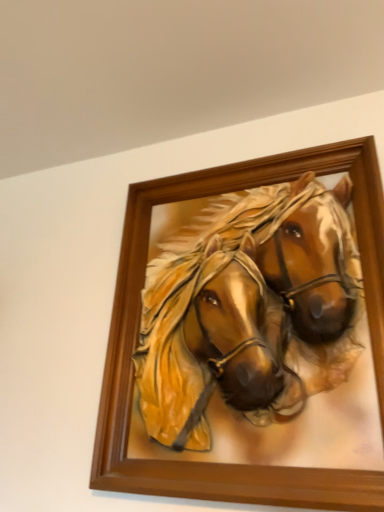
In order to face shiny gold horse at upper center, should I rotate leftwards or rightwards?

To align with it, rotate right about 6.228°.

I want to click on shiny gold horse at upper center, so click(249, 309).

What do you see at coordinates (249, 309) in the screenshot?
I see `shiny gold horse at upper center` at bounding box center [249, 309].

Locate an element on the screen. This screenshot has width=384, height=512. shiny gold horse at upper center is located at coordinates click(x=249, y=309).